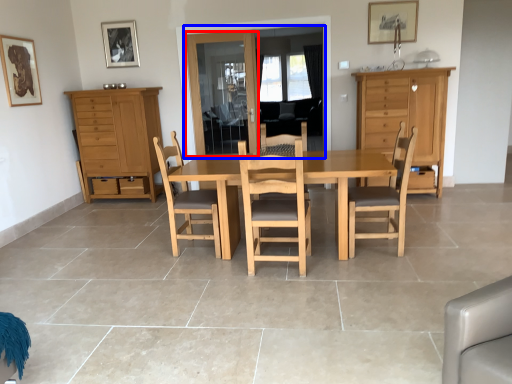
Question: Among these objects, which one is nearest to the camera, glass door (highlighted by a red box) or glass door (highlighted by a blue box)?

Choices:
 (A) glass door
 (B) glass door

Answer: (B)